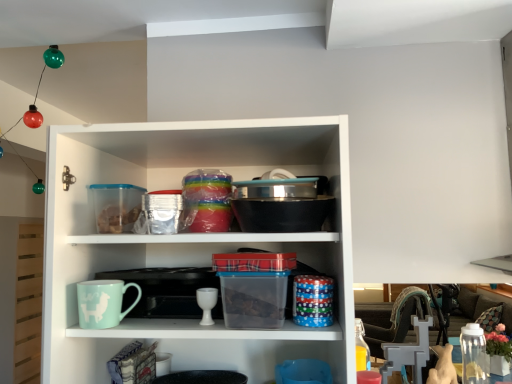
Question: Is white glossy goblet at center inside the boundaries of clear plastic jar at lower right, or outside?

Choices:
 (A) outside
 (B) inside

Answer: (A)

Question: Considering the positions of point (211, 324) and point (475, 347), is point (211, 324) closer or farther from the camera than point (475, 347)?

Choices:
 (A) closer
 (B) farther

Answer: (A)

Question: Which object is positioned farthest from the white glossy goblet at center?

Choices:
 (A) clear plastic jar at lower right
 (B) light blue ceramic mug at lower left

Answer: (A)

Question: Based on their relative distances, which object is farther from the light blue ceramic mug at lower left?

Choices:
 (A) clear plastic jar at lower right
 (B) white glossy goblet at center

Answer: (A)